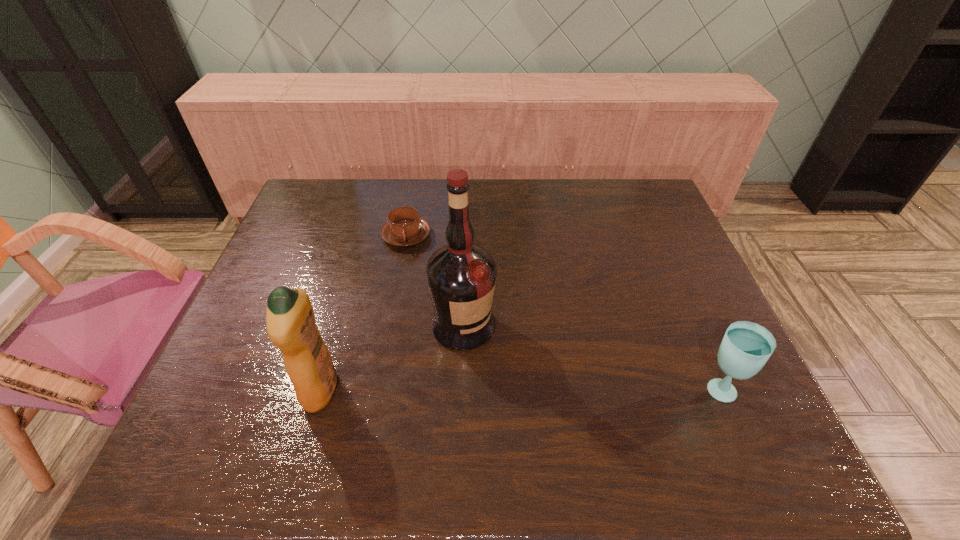
The width and height of the screenshot is (960, 540). I want to click on free space on the desktop that is between the detergent and the rightmost object and is positioned on the side of the farthest object with the handle, so pyautogui.click(x=493, y=389).

Find the location of a particular element. This screenshot has width=960, height=540. vacant spot on the desktop that is between the leftmost object and the third tallest object and is positioned on the surface of the second farthest object is located at coordinates (535, 389).